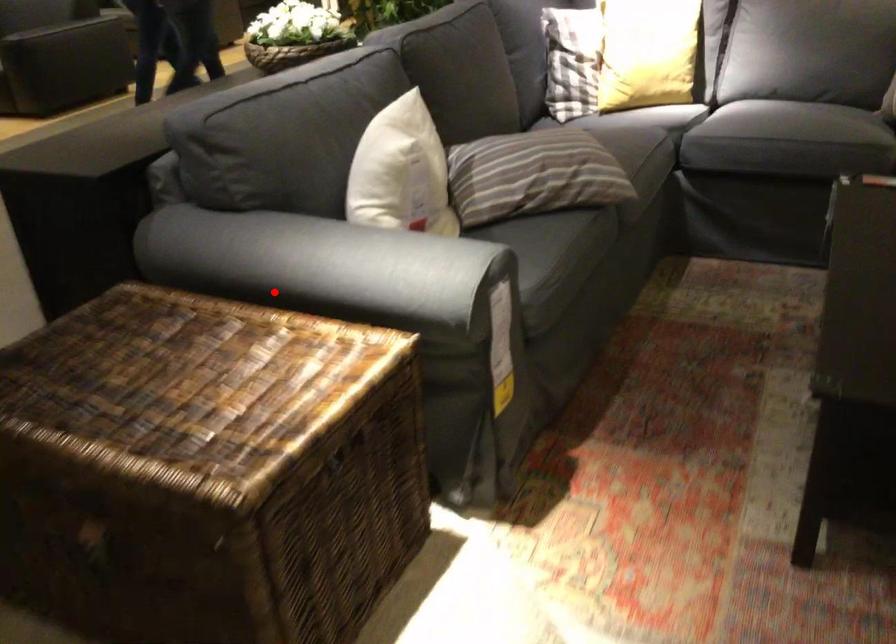
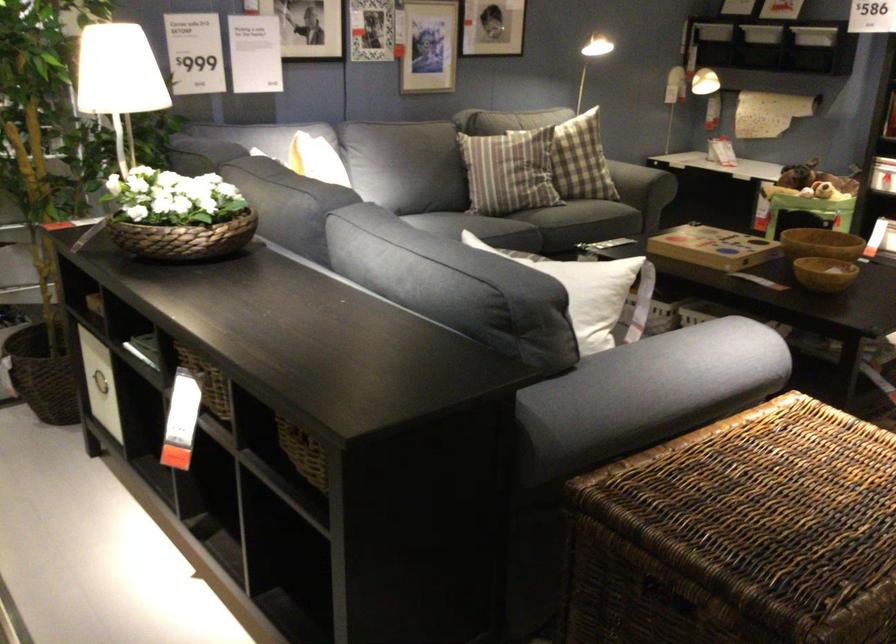
Find the pixel in the second image that matches the highlighted location in the first image.

(647, 393)